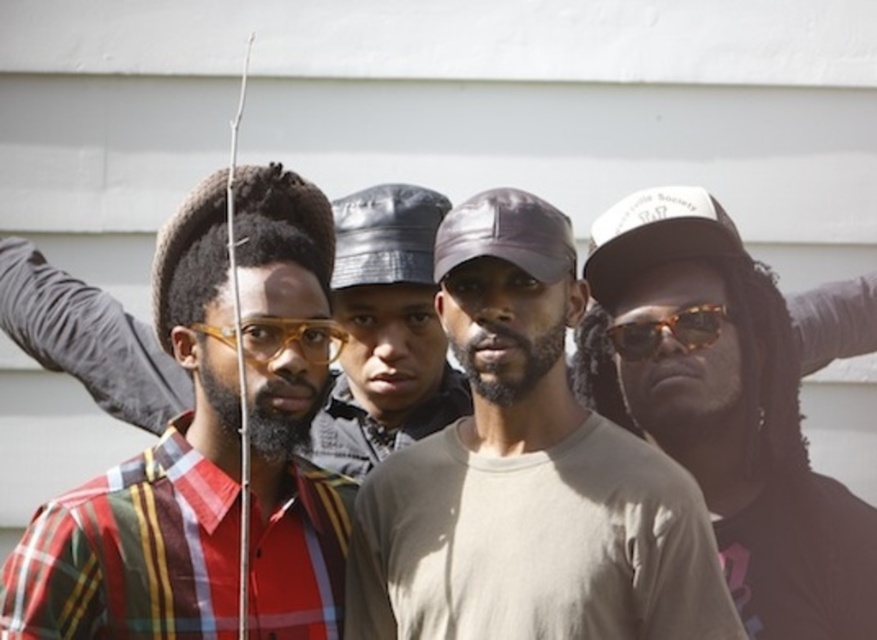
Question: Does brown leather cap at center have a lesser width compared to matte black cap at center?

Choices:
 (A) yes
 (B) no

Answer: (B)

Question: Which is nearer to the matte gray cap at center?

Choices:
 (A) leather-like baseball cap at center
 (B) matte black cap at center

Answer: (B)

Question: Which point appears farthest from the camera in this image?

Choices:
 (A) (689, 340)
 (B) (425, 252)

Answer: (B)

Question: Which of the following is the farthest from the observer?

Choices:
 (A) (662, 230)
 (B) (610, 560)
 (C) (503, 246)

Answer: (A)

Question: Can you confirm if matte black cap at center is wider than tortoiseshell acetate sunglasses at right?

Choices:
 (A) yes
 (B) no

Answer: (A)

Question: Does matte black cap at center have a smaller size compared to tortoiseshell acetate sunglasses at right?

Choices:
 (A) no
 (B) yes

Answer: (A)